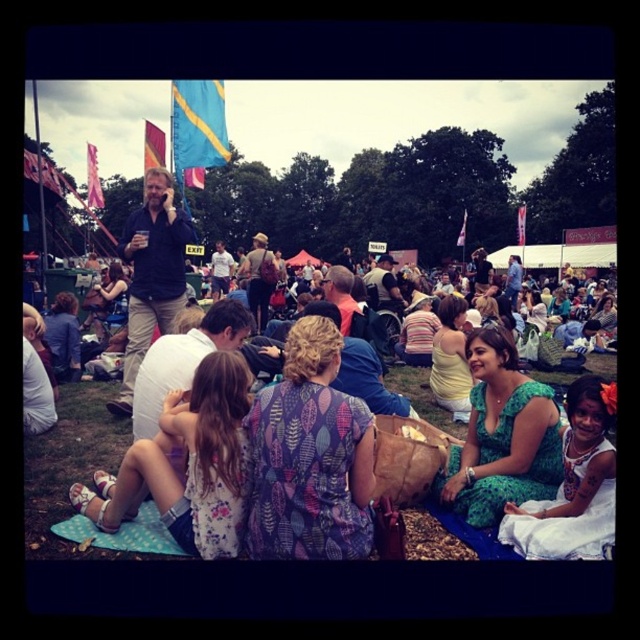
Question: Is the position of blue fabric flag at upper center less distant than that of matte brown backpack at center?

Choices:
 (A) yes
 (B) no

Answer: (B)

Question: Can you confirm if dark blue shirt at center is smaller than blue fabric flag at upper center?

Choices:
 (A) no
 (B) yes

Answer: (A)

Question: Which object appears farthest from the camera in this image?

Choices:
 (A) matte brown backpack at center
 (B) printed fabric blanket at center
 (C) blue fabric flag at upper center
 (D) dark blue shirt at center

Answer: (C)

Question: Does printed fabric blanket at center appear on the right side of blue fabric flag at upper center?

Choices:
 (A) yes
 (B) no

Answer: (A)

Question: Among these objects, which one is farthest from the camera?

Choices:
 (A) blue fabric flag at upper center
 (B) matte brown backpack at center
 (C) dark blue shirt at center
 (D) printed fabric blanket at center

Answer: (A)

Question: Which point appears closest to the camera in this image?

Choices:
 (A) (497, 548)
 (B) (348, 328)
 (C) (163, 221)
 (D) (195, 88)

Answer: (A)